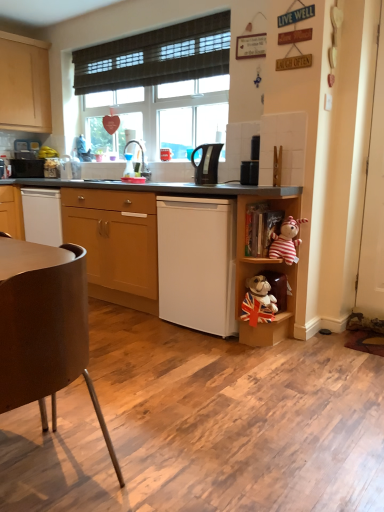
Question: Does white plastic shelf at lower right, marked as the first shelf in a bottom-to-top arrangement, contain striped fabric monkey at right?

Choices:
 (A) no
 (B) yes

Answer: (A)

Question: From the image's perspective, would you say white plastic shelf at lower right, marked as the first shelf in a bottom-to-top arrangement, is shown under striped fabric monkey at right?

Choices:
 (A) no
 (B) yes

Answer: (B)

Question: Does white plastic shelf at lower right, marked as the first shelf in a bottom-to-top arrangement, have a greater width compared to striped fabric monkey at right?

Choices:
 (A) yes
 (B) no

Answer: (A)

Question: Does white plastic shelf at lower right, marked as the first shelf in a bottom-to-top arrangement, come behind striped fabric monkey at right?

Choices:
 (A) yes
 (B) no

Answer: (A)

Question: Does white plastic shelf at lower right, the 3th shelf viewed from the top, have a smaller size compared to striped fabric monkey at right?

Choices:
 (A) yes
 (B) no

Answer: (B)

Question: In terms of width, does white matte dishwasher at center look wider or thinner when compared to wooden bookshelf at center-right, arranged as the first shelf when viewed from the top?

Choices:
 (A) thin
 (B) wide

Answer: (B)

Question: From the image's perspective, is white matte dishwasher at center positioned above or below wooden bookshelf at center-right, arranged as the first shelf when viewed from the top?

Choices:
 (A) below
 (B) above

Answer: (A)

Question: Is point click(157, 200) positioned closer to the camera than point click(289, 196)?

Choices:
 (A) farther
 (B) closer

Answer: (A)

Question: Based on their sizes in the image, would you say white matte dishwasher at center is bigger or smaller than wooden bookshelf at center-right, arranged as the first shelf when viewed from the top?

Choices:
 (A) big
 (B) small

Answer: (A)

Question: From a real-world perspective, is wooden bookshelf at center-right, the 3th shelf positioned from the bottom, physically located above or below striped fabric monkey at right?

Choices:
 (A) below
 (B) above

Answer: (B)

Question: From their relative heights in the image, would you say wooden bookshelf at center-right, the 3th shelf positioned from the bottom, is taller or shorter than striped fabric monkey at right?

Choices:
 (A) short
 (B) tall

Answer: (B)

Question: Is wooden bookshelf at center-right, arranged as the first shelf when viewed from the top, spatially inside striped fabric monkey at right, or outside of it?

Choices:
 (A) outside
 (B) inside

Answer: (A)

Question: Is wooden bookshelf at center-right, arranged as the first shelf when viewed from the top, wider or thinner than striped fabric monkey at right?

Choices:
 (A) wide
 (B) thin

Answer: (B)

Question: Choose the correct answer: Is brown matte chair at lower left inside transparent plastic sink at center, which is the second appliance in front-to-back order, or outside it?

Choices:
 (A) inside
 (B) outside

Answer: (B)

Question: From the image's perspective, is brown matte chair at lower left located above or below transparent plastic sink at center, the second appliance viewed from the right?

Choices:
 (A) above
 (B) below

Answer: (B)